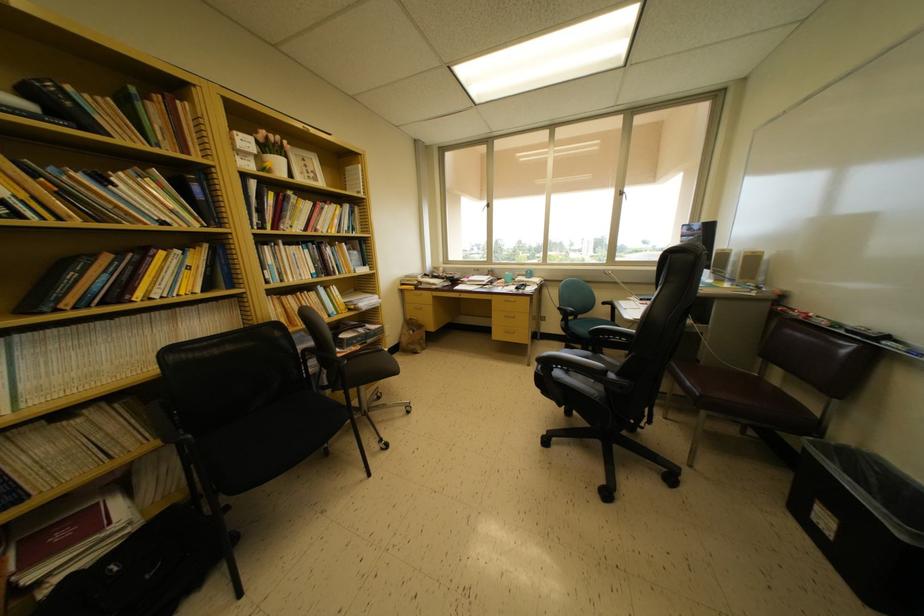
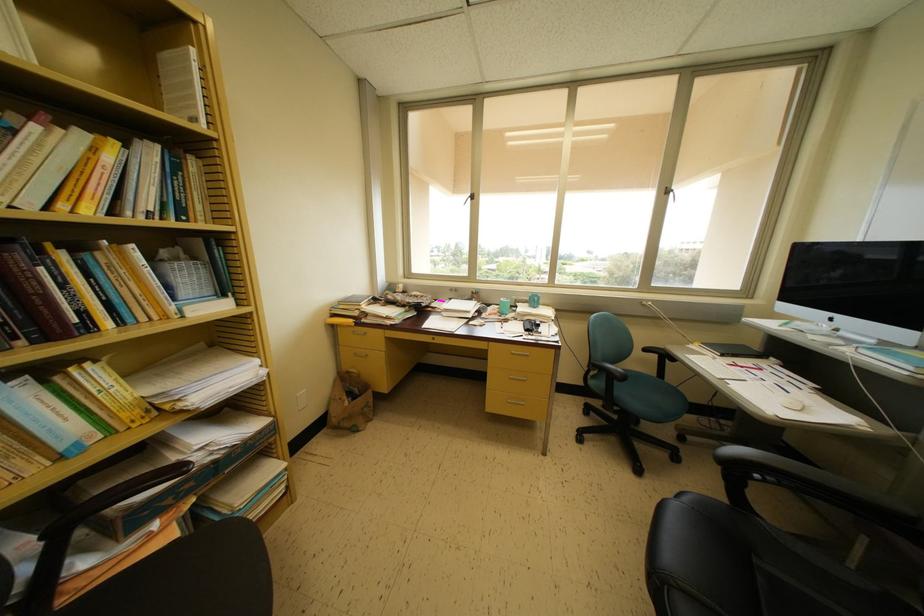
Where in the second image is the point corresponding to point 478,281 from the first image?

(455, 304)